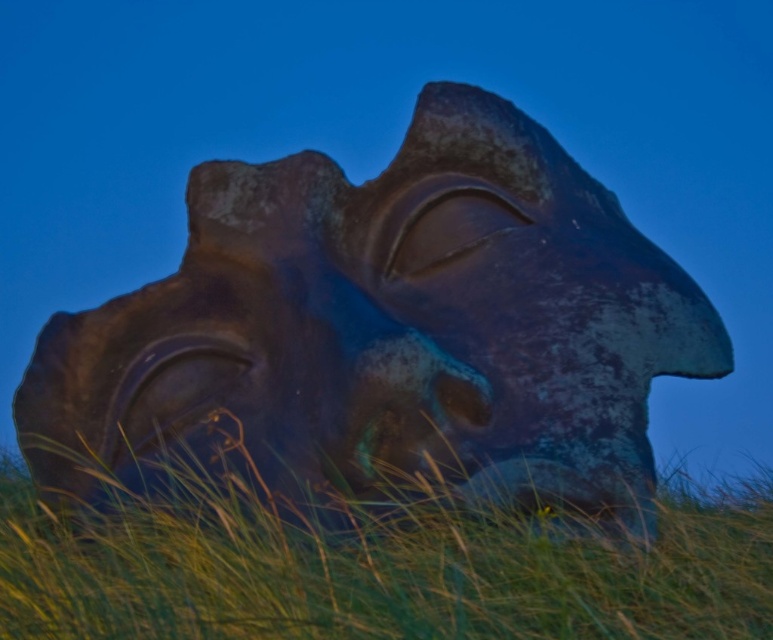
The image size is (773, 640). I want to click on rusty stone sculpture at center, so click(x=383, y=333).

Does rusty stone sculpture at center have a smaller size compared to green grass at lower center?

No.

Does point (537, 328) lie behind point (554, 612)?

Yes, it is behind point (554, 612).

Find the location of `rusty stone sculpture at center`. rusty stone sculpture at center is located at coordinates (383, 333).